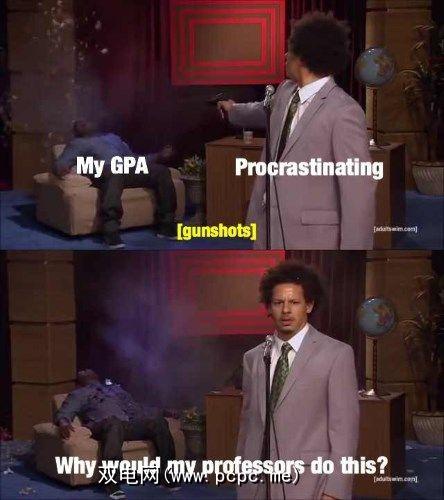
Locate an element on the screen. couch is located at coordinates point(88,196), point(75,439).